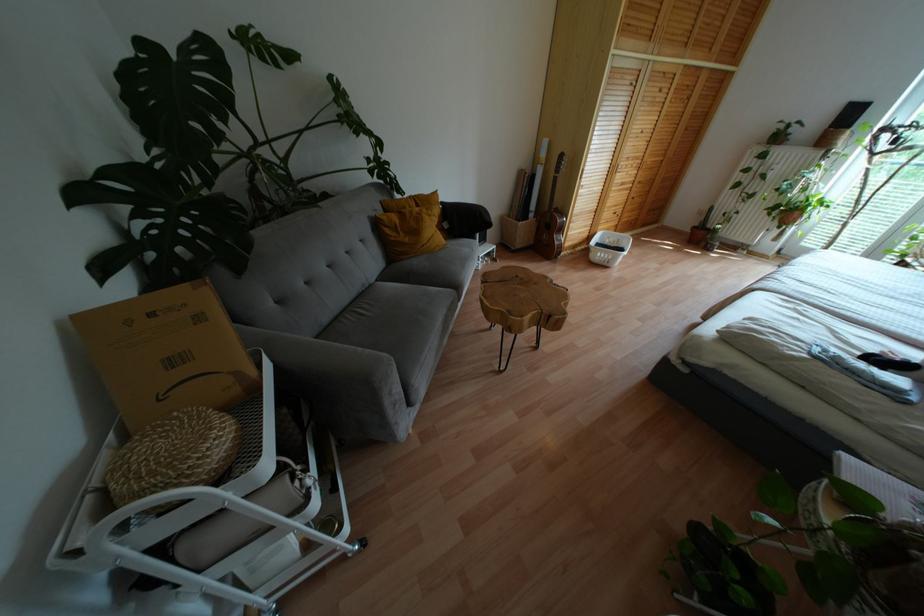
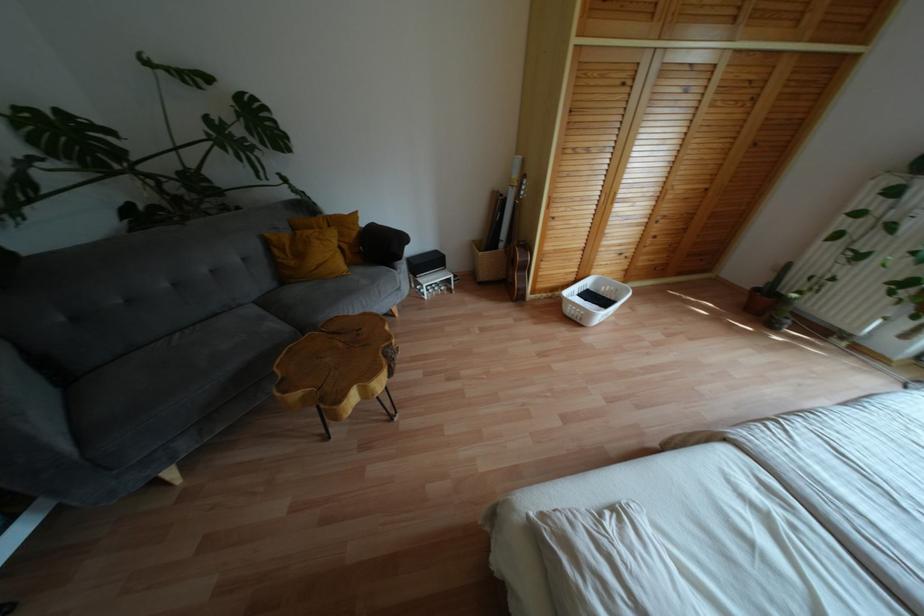
Find the pixel in the second image that matches [434,193] in the first image.

(354, 214)